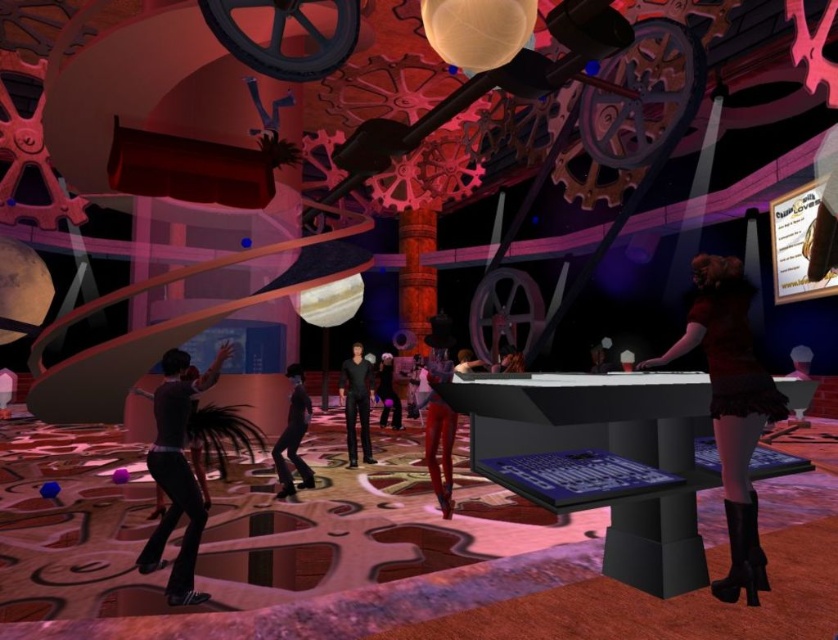
Who is lower down, shiny black pants at center or matte black suit at center?

matte black suit at center is lower down.

The width and height of the screenshot is (838, 640). Identify the location of shiny black pants at center. (293, 436).

Consider the image. Between shiny black suit at center left and shiny black pants at center, which one is positioned higher?

Positioned higher is shiny black suit at center left.

Is point (180, 388) positioned in front of point (299, 384)?

Yes, it is.

The width and height of the screenshot is (838, 640). Find the location of `shiny black suit at center left`. shiny black suit at center left is located at coordinates (177, 472).

Between point (443, 458) and point (309, 481), which one is positioned behind?

Point (309, 481)

Is point (435, 356) positioned before point (295, 396)?

Yes, it is in front of point (295, 396).

Image resolution: width=838 pixels, height=640 pixels. Find the location of `shiny red pants at center`. shiny red pants at center is located at coordinates (440, 420).